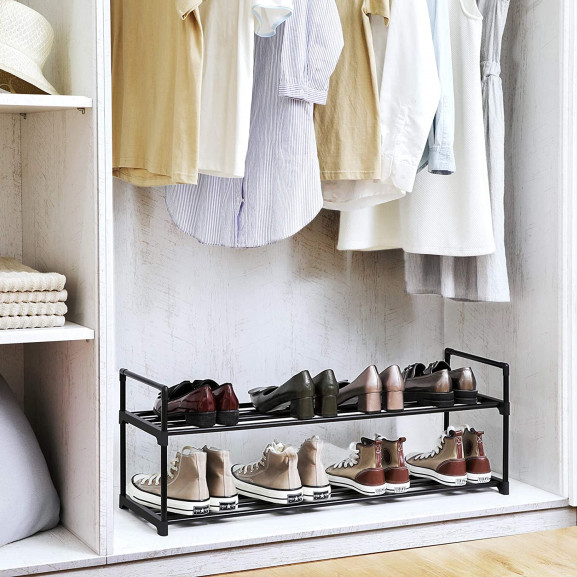
Where is `shelves`? shelves is located at coordinates (x=277, y=505), (x=252, y=423), (x=76, y=560), (x=231, y=544), (x=46, y=329), (x=51, y=96).